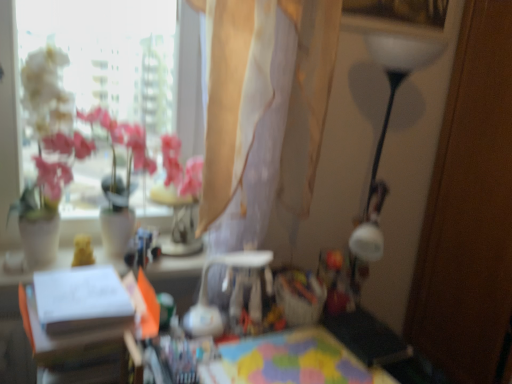
I want to click on translucent beige curtain at upper center, so click(265, 95).

The height and width of the screenshot is (384, 512). Identify the location of white paper at center, the first table viewed from the left. (178, 278).

Where is `translucent beige curtain at upper center`? The width and height of the screenshot is (512, 384). translucent beige curtain at upper center is located at coordinates (265, 95).

From the image's perspective, between white paper at center, the first table viewed from the left, and translucent beige curtain at upper center, which one is located above?

translucent beige curtain at upper center.

Is white paper at center, which is the second table in right-to-left order, to the left of translucent beige curtain at upper center from the viewer's perspective?

Indeed, white paper at center, which is the second table in right-to-left order, is positioned on the left side of translucent beige curtain at upper center.

Is white paper at center, the first table viewed from the left, spatially inside translucent beige curtain at upper center, or outside of it?

white paper at center, the first table viewed from the left, is not enclosed by translucent beige curtain at upper center.

This screenshot has width=512, height=384. I want to click on the 2nd table in front when counting from the translucent beige curtain at upper center, so click(178, 278).

Measure the distance between multicolored fabric at center, the 2th table positioned from the left, and white paper at center, the first table viewed from the left.

multicolored fabric at center, the 2th table positioned from the left, is 17.08 inches away from white paper at center, the first table viewed from the left.

Between multicolored fabric at center, acting as the 1th table starting from the right, and white paper at center, the first table viewed from the left, which one appears on the left side from the viewer's perspective?

Positioned to the left is white paper at center, the first table viewed from the left.

Is multicolored fabric at center, the 2th table positioned from the left, in front of or behind white paper at center, the first table viewed from the left, in the image?

Visually, multicolored fabric at center, the 2th table positioned from the left, is located behind white paper at center, the first table viewed from the left.

Are multicolored fabric at center, acting as the 1th table starting from the right, and white paper at center, which is the second table in right-to-left order, beside each other?

No, multicolored fabric at center, acting as the 1th table starting from the right, is not next to white paper at center, which is the second table in right-to-left order.

Who is taller, translucent beige curtain at upper center or multicolored fabric at center, acting as the 1th table starting from the right?

Standing taller between the two is translucent beige curtain at upper center.

Consider the image. Which is more to the left, translucent beige curtain at upper center or multicolored fabric at center, acting as the 1th table starting from the right?

translucent beige curtain at upper center is more to the left.

The image size is (512, 384). I want to click on curtain above the multicolored fabric at center, the 2th table positioned from the left (from the image's perspective), so click(x=265, y=95).

Which of these two, translucent beige curtain at upper center or multicolored fabric at center, the 2th table positioned from the left, is bigger?

With larger size is translucent beige curtain at upper center.

From a real-world perspective, is translucent beige curtain at upper center physically located above or below white paper at center, which is the second table in right-to-left order?

From a real-world perspective, translucent beige curtain at upper center is physically above white paper at center, which is the second table in right-to-left order.

Would you say translucent beige curtain at upper center is inside or outside white paper at center, the first table viewed from the left?

A: translucent beige curtain at upper center is not inside white paper at center, the first table viewed from the left, it's outside.

Is translucent beige curtain at upper center bigger or smaller than white paper at center, the first table viewed from the left?

translucent beige curtain at upper center is bigger than white paper at center, the first table viewed from the left.

Consider the image. From the image's perspective, is translucent beige curtain at upper center located above or below white paper at center, which is the second table in right-to-left order?

translucent beige curtain at upper center is above white paper at center, which is the second table in right-to-left order.

Considering their positions, is white paper at center, which is the second table in right-to-left order, located in front of or behind multicolored fabric at center, acting as the 1th table starting from the right?

white paper at center, which is the second table in right-to-left order, is positioned closer to the viewer than multicolored fabric at center, acting as the 1th table starting from the right.

From the picture: Choose the correct answer: Is white paper at center, the first table viewed from the left, inside multicolored fabric at center, acting as the 1th table starting from the right, or outside it?

white paper at center, the first table viewed from the left, is not enclosed by multicolored fabric at center, acting as the 1th table starting from the right.

In terms of width, does white paper at center, the first table viewed from the left, look wider or thinner when compared to multicolored fabric at center, acting as the 1th table starting from the right?

white paper at center, the first table viewed from the left, is wider than multicolored fabric at center, acting as the 1th table starting from the right.

Is point (175, 264) positioned behind point (260, 337)?

Yes, it is.

Where is `the 2nd table below the translucent beige curtain at upper center (from the image's perspective)`? The height and width of the screenshot is (384, 512). the 2nd table below the translucent beige curtain at upper center (from the image's perspective) is located at coordinates (290, 361).

Can you tell me how much multicolored fabric at center, the 2th table positioned from the left, and translucent beige curtain at upper center differ in facing direction?

The angular difference between multicolored fabric at center, the 2th table positioned from the left, and translucent beige curtain at upper center is 5.02 degrees.

Is multicolored fabric at center, the 2th table positioned from the left, far away from translucent beige curtain at upper center?

No, there isn't a large distance between multicolored fabric at center, the 2th table positioned from the left, and translucent beige curtain at upper center.

Is multicolored fabric at center, the 2th table positioned from the left, not within translucent beige curtain at upper center?

Yes.

You are a GUI agent. You are given a task and a screenshot of the screen. Output one action in this format:
    pyautogui.click(x=<x>, y=<y>)
    Task: Click on the table on the left of the translucent beige curtain at upper center
    
    Given the screenshot: What is the action you would take?
    pyautogui.click(x=178, y=278)

At what (x,y) coordinates should I click in order to perform the action: click on table on the right of white paper at center, which is the second table in right-to-left order. Please return your answer as a coordinate pair (x, y). The image size is (512, 384). Looking at the image, I should click on (290, 361).

Estimate the real-world distances between objects in this image. Which object is closer to translucent beige curtain at upper center, white paper at center, which is the second table in right-to-left order, or multicolored fabric at center, the 2th table positioned from the left?

white paper at center, which is the second table in right-to-left order, is positioned closer to the anchor translucent beige curtain at upper center.

Which object lies nearer to the anchor point translucent beige curtain at upper center, multicolored fabric at center, acting as the 1th table starting from the right, or white paper at center, the first table viewed from the left?

white paper at center, the first table viewed from the left, is positioned closer to the anchor translucent beige curtain at upper center.

Considering their positions, is translucent beige curtain at upper center positioned closer to white paper at center, which is the second table in right-to-left order, than multicolored fabric at center, acting as the 1th table starting from the right?

multicolored fabric at center, acting as the 1th table starting from the right, is closer to white paper at center, which is the second table in right-to-left order.

When comparing their distances from multicolored fabric at center, acting as the 1th table starting from the right, does white paper at center, the first table viewed from the left, or translucent beige curtain at upper center seem closer?

white paper at center, the first table viewed from the left, lies closer to multicolored fabric at center, acting as the 1th table starting from the right, than the other object.

Estimate the real-world distances between objects in this image. Which object is closer to multicolored fabric at center, the 2th table positioned from the left, translucent beige curtain at upper center or white paper at center, the first table viewed from the left?

white paper at center, the first table viewed from the left.

Based on their spatial positions, is multicolored fabric at center, the 2th table positioned from the left, or translucent beige curtain at upper center further from white paper at center, which is the second table in right-to-left order?

translucent beige curtain at upper center is further to white paper at center, which is the second table in right-to-left order.

This screenshot has height=384, width=512. I want to click on table between translucent beige curtain at upper center and multicolored fabric at center, acting as the 1th table starting from the right, vertically, so click(x=178, y=278).